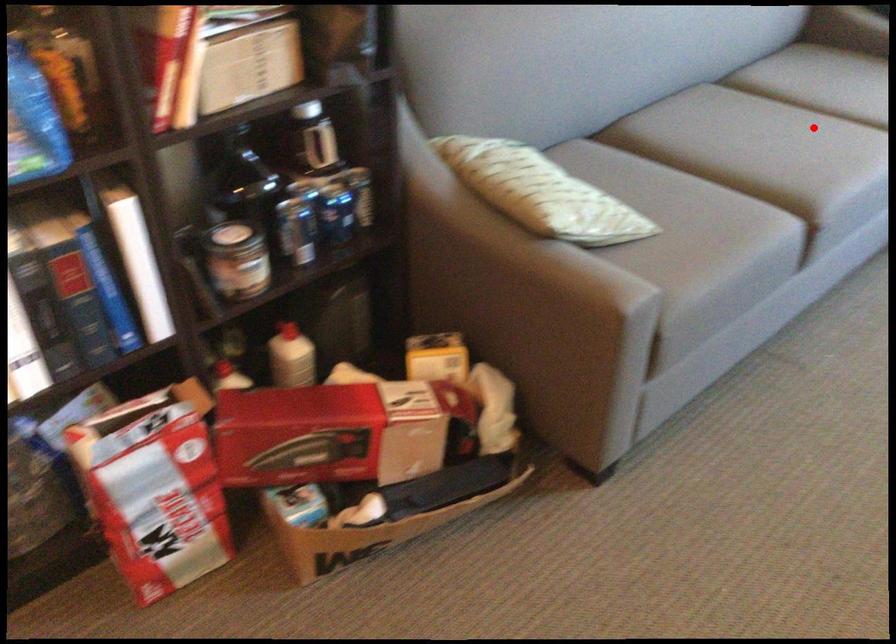
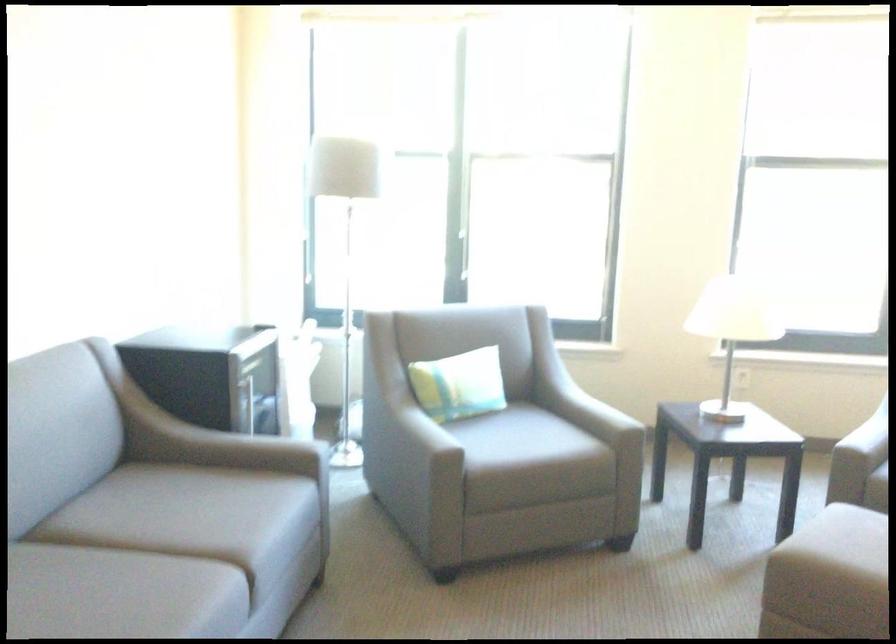
Where in the second image is the point corresponding to the highlighted location from the first image?

(119, 594)